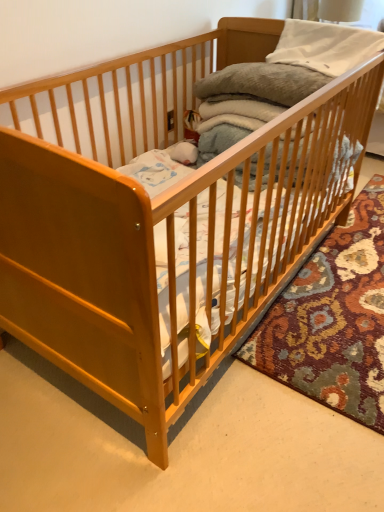
This screenshot has height=512, width=384. What do you see at coordinates (263, 82) in the screenshot? I see `soft gray fabric pillow at upper center` at bounding box center [263, 82].

The height and width of the screenshot is (512, 384). In order to click on soft gray fabric pillow at upper center in this screenshot , I will do `click(263, 82)`.

Image resolution: width=384 pixels, height=512 pixels. In order to click on soft gray fabric pillow at upper center in this screenshot , I will do `click(263, 82)`.